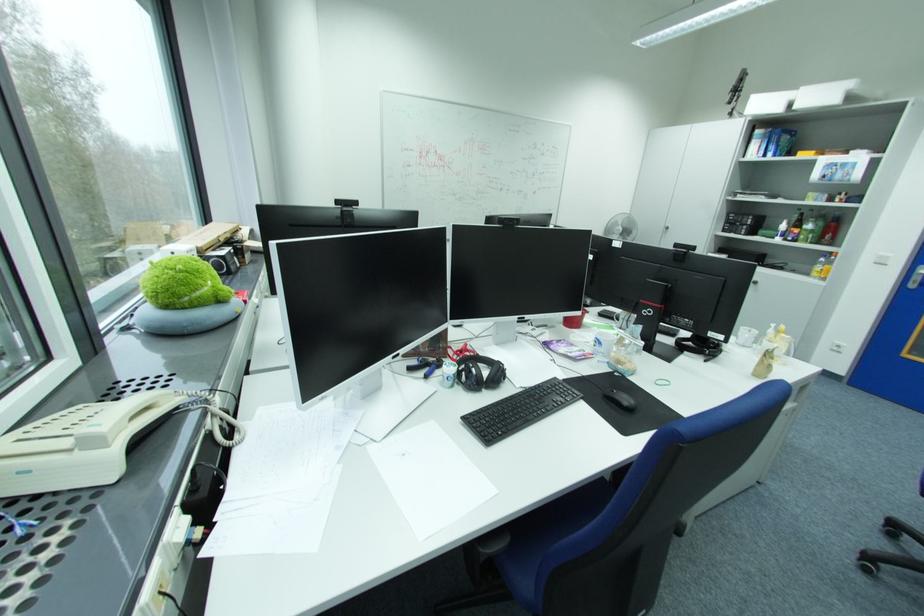
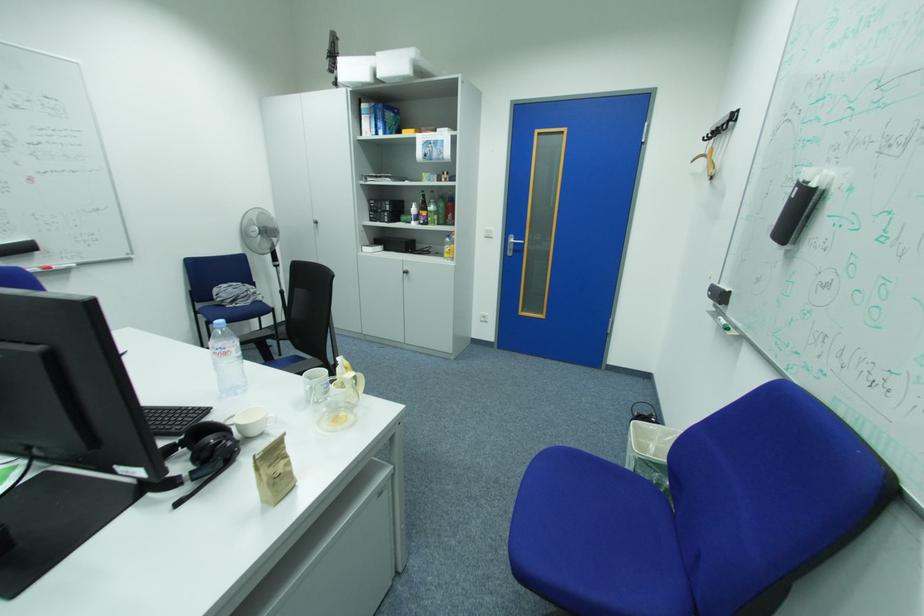
In the second image, find the point that corresponds to (x=720, y=354) in the first image.

(203, 476)